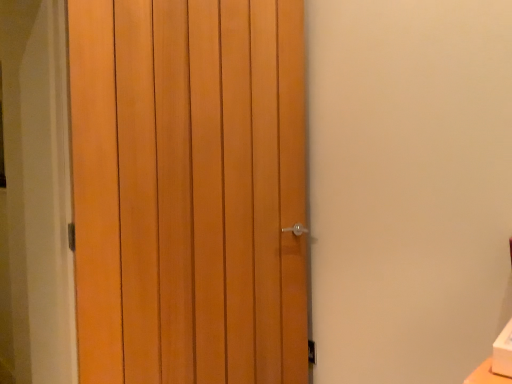
In order to face wooden door at center, should I rotate leftwards or rightwards?

A 6.473 degree turn to the left will do.

At what (x,y) coordinates should I click in order to perform the action: click on wooden door at center. Please return your answer as a coordinate pair (x, y). This screenshot has width=512, height=384. Looking at the image, I should click on (189, 190).

What do you see at coordinates (189, 190) in the screenshot?
I see `wooden door at center` at bounding box center [189, 190].

Locate an element on the screen. Image resolution: width=512 pixels, height=384 pixels. wooden door at center is located at coordinates (189, 190).